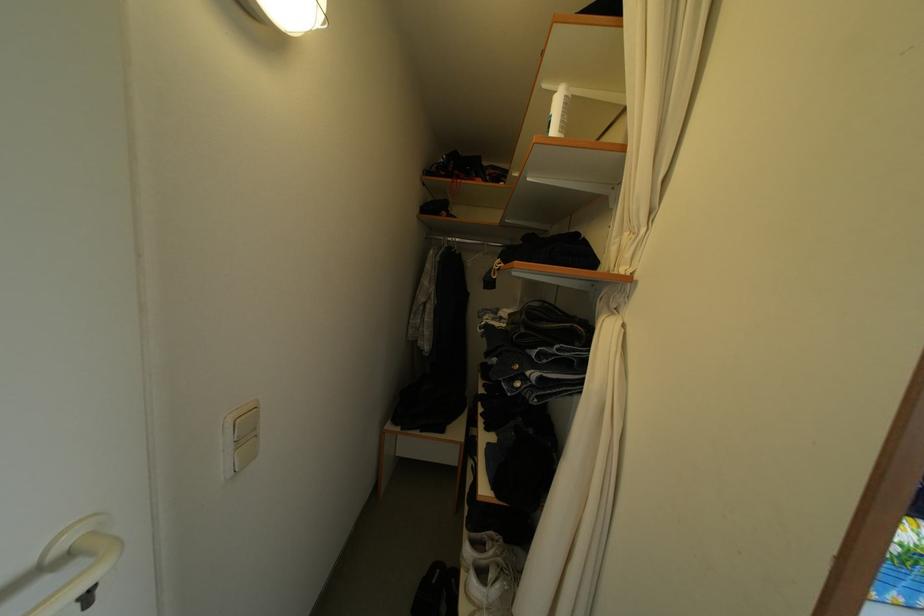
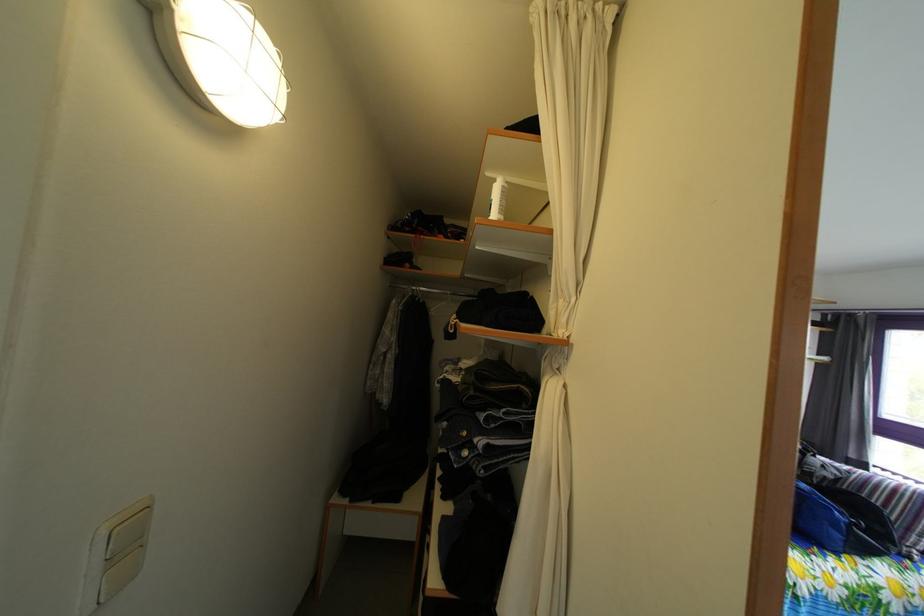
Locate, in the second image, the point that corresponds to point 454,246 in the first image.

(418, 294)